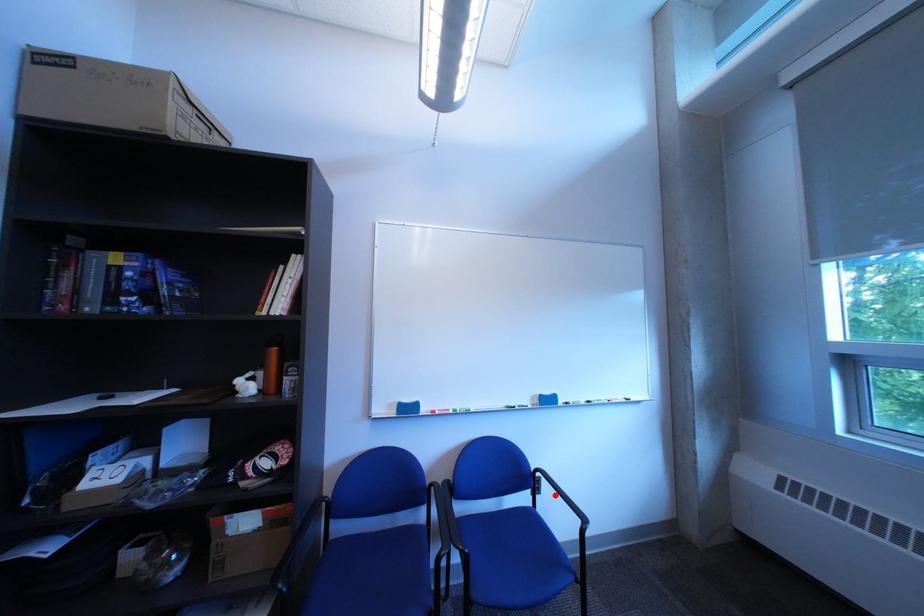
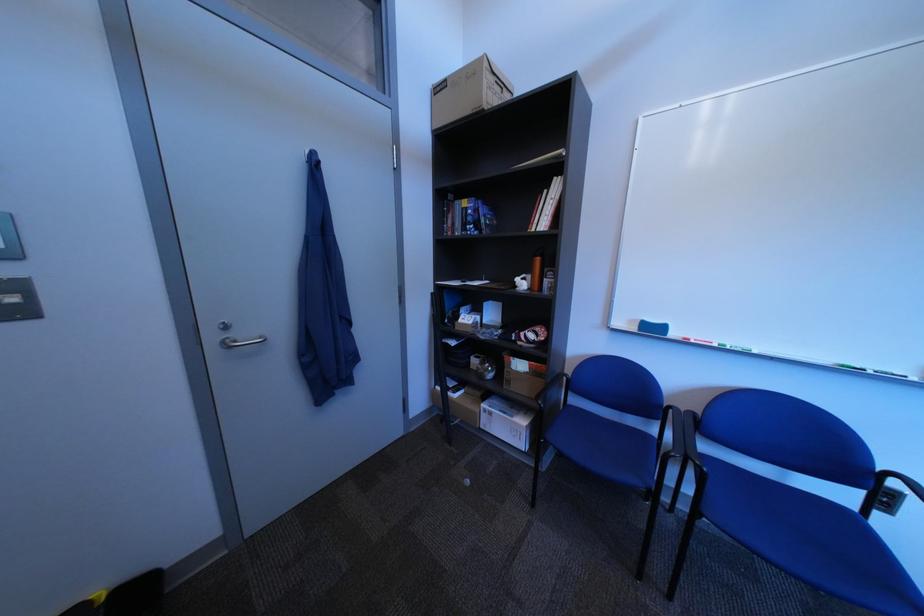
Question: I am providing you with two images of the same scene from different viewpoints. In image1, a red point is highlighted. Considering the same 3D point in image2, which of the following is correct?

Choices:
 (A) It is closer
 (B) It is farther

Answer: (A)